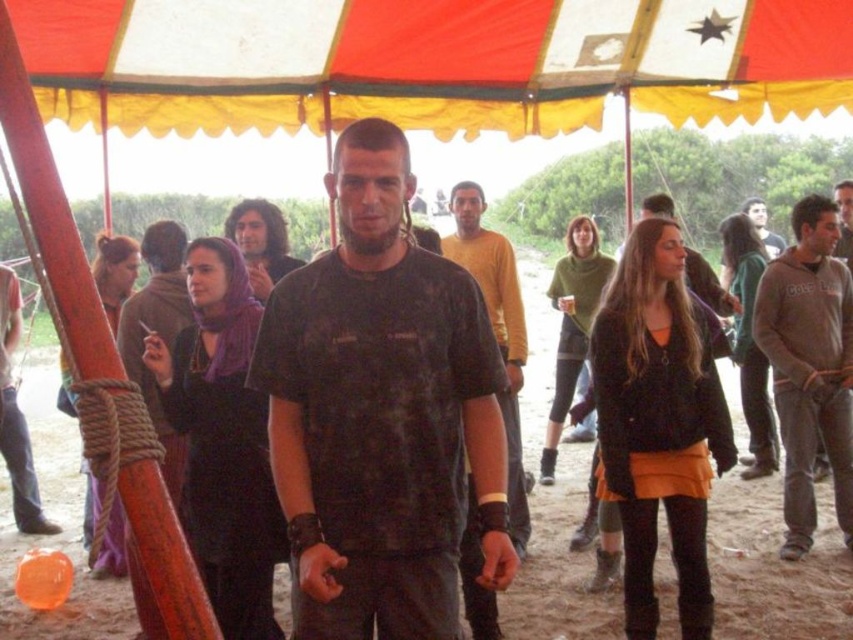
Question: Can you confirm if red and white striped canopy at upper center is smaller than gray fleece sweatshirt at right?

Choices:
 (A) yes
 (B) no

Answer: (B)

Question: Does red and white striped canopy at upper center lie in front of matte black shirt at center?

Choices:
 (A) no
 (B) yes

Answer: (B)

Question: Which object is the farthest from the gray fleece sweatshirt at right?

Choices:
 (A) red and white striped canopy at upper center
 (B) dark matte t-shirt at center
 (C) matte black shirt at center
 (D) matte yellow shirt at center

Answer: (C)

Question: Which object appears farthest from the camera in this image?

Choices:
 (A) matte black shirt at center
 (B) dark matte t-shirt at center
 (C) red and white striped canopy at upper center

Answer: (A)

Question: Which of these objects is positioned closest to the red and white striped canopy at upper center?

Choices:
 (A) gray fleece sweatshirt at right
 (B) dark matte t-shirt at center
 (C) matte yellow shirt at center

Answer: (C)

Question: Is dark matte t-shirt at center bigger than matte black shirt at center?

Choices:
 (A) no
 (B) yes

Answer: (A)